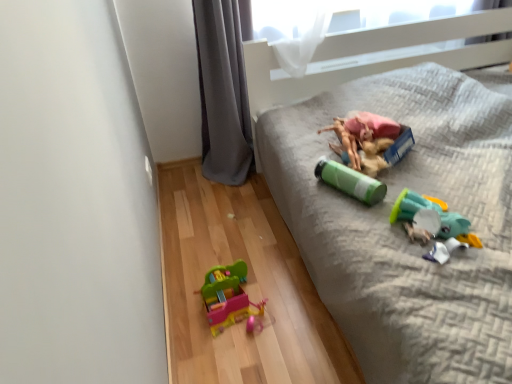
This screenshot has height=384, width=512. I want to click on blank area to the left of multicolored plastic toy at lower center, marked as the 1th toy in a bottom-to-top arrangement, so click(x=184, y=307).